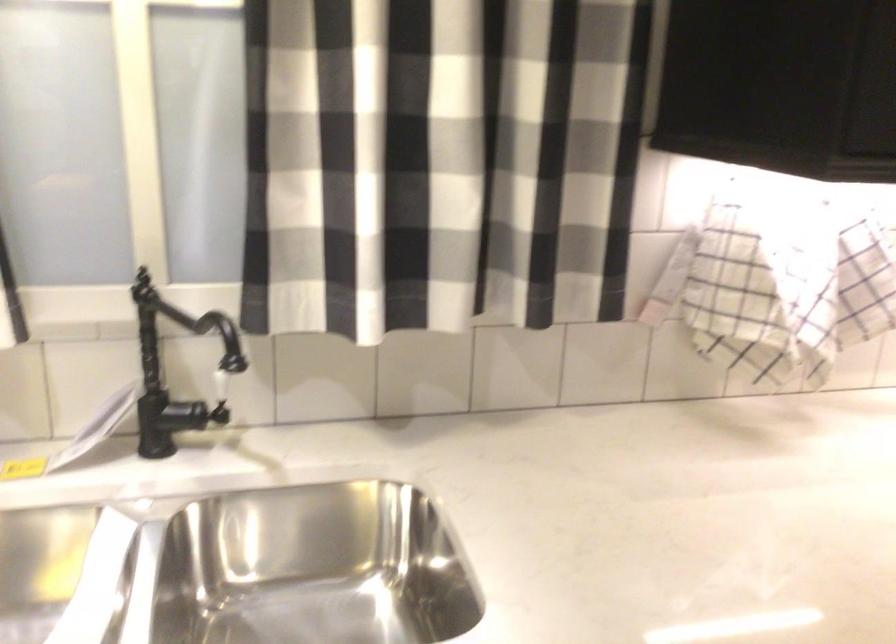
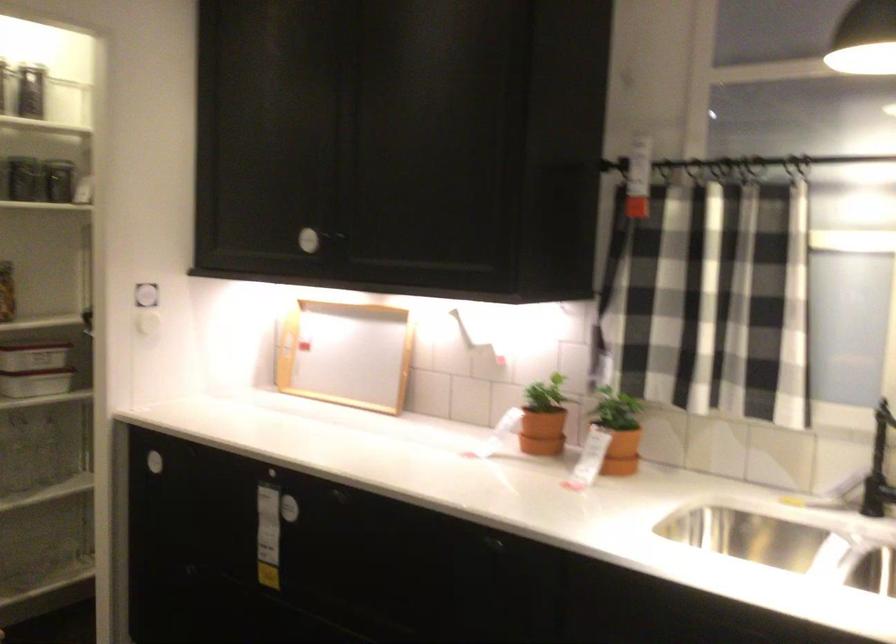
The point at (178, 391) is marked in the first image. Where is the corresponding point in the second image?

(879, 468)